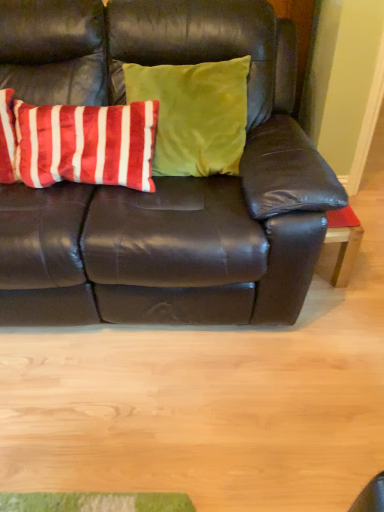
At what (x,y) coordinates should I click in order to perform the action: click on space that is in front of matte black couch at center. Please return your answer as a coordinate pair (x, y). Looking at the image, I should click on [x=160, y=412].